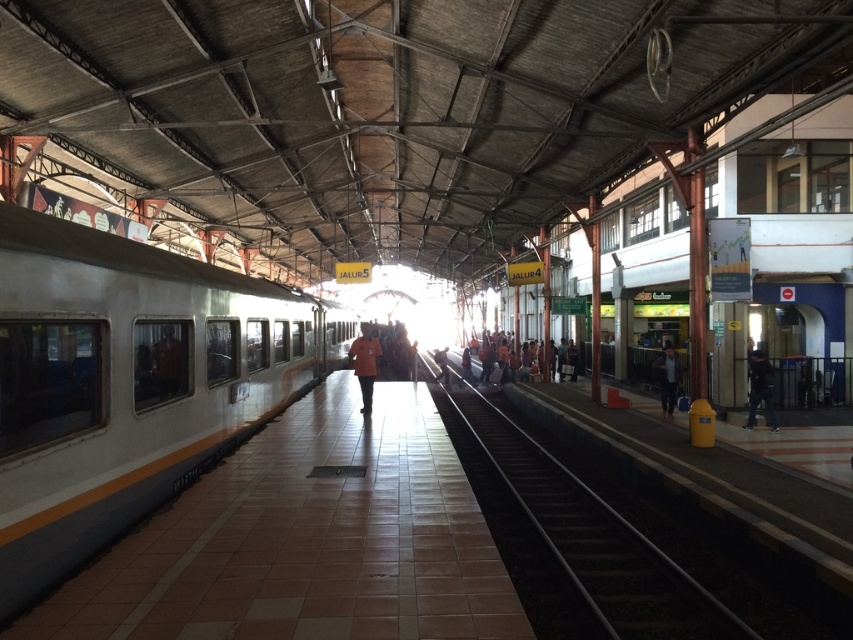
You are a photographer trying to capture both the silver metallic train at left and the orange fabric shirt at center in a single shot. Which object should you focus on first to ensure both are in frame?

You should focus on the silver metallic train at left first because it is larger than the orange fabric shirt at center, ensuring it fits within the frame while still capturing the smaller shirt.

You are standing on the train station platform and notice the silver metallic train at left and the orange fabric shirt at center. Which object is nearer to you?

The silver metallic train at left is closer to you than the orange fabric shirt at center.

You are standing on the train station platform and want to reach the point marked at coordinates (558, 490). If your walking speed is 1.5 meters per second, how many seconds will it take you to reach that point?

The point marked at coordinates (558, 490) is 11.17 meters away from you. At a walking speed of 1.5 meters per second, it will take approximately 7.45 seconds to reach the point.